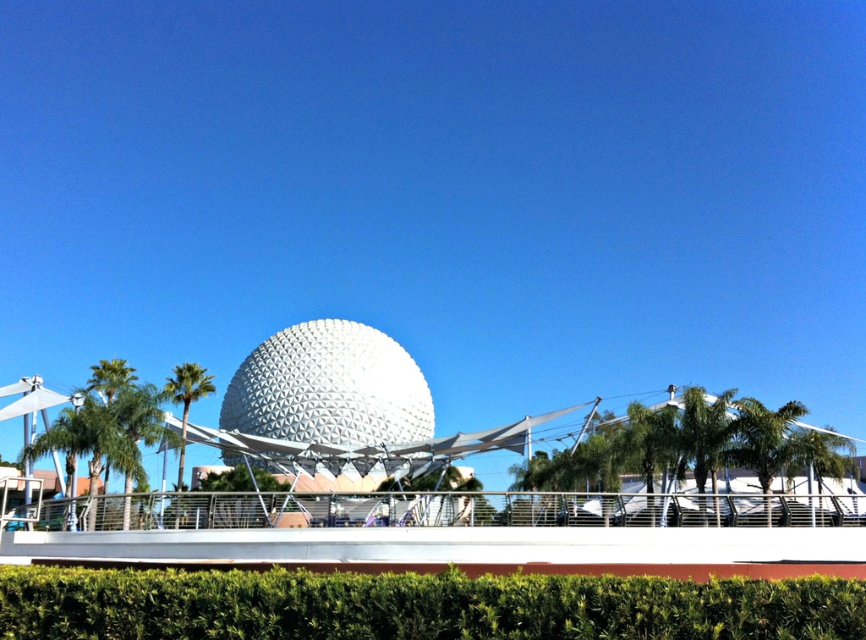
Question: Can you confirm if green leafy hedge at lower center is positioned to the right of green leafy palm tree at right?

Choices:
 (A) no
 (B) yes

Answer: (A)

Question: Which object appears farthest from the camera in this image?

Choices:
 (A) white matte sphere at center
 (B) green leafy palm tree at right

Answer: (B)

Question: Which point is farther to the camera?

Choices:
 (A) (783, 428)
 (B) (212, 385)
 (C) (448, 612)

Answer: (B)

Question: Does green leafy palm tree at right have a smaller size compared to green leafy palm tree at left?

Choices:
 (A) no
 (B) yes

Answer: (B)

Question: Which is nearer to the green leafy hedge at lower center?

Choices:
 (A) green leafy palm tree at left
 (B) white matte sphere at center
 (C) green leafy palm tree at right

Answer: (C)

Question: Considering the relative positions of green leafy hedge at lower center and green leafy palm tree at left in the image provided, where is green leafy hedge at lower center located with respect to green leafy palm tree at left?

Choices:
 (A) left
 (B) right

Answer: (B)